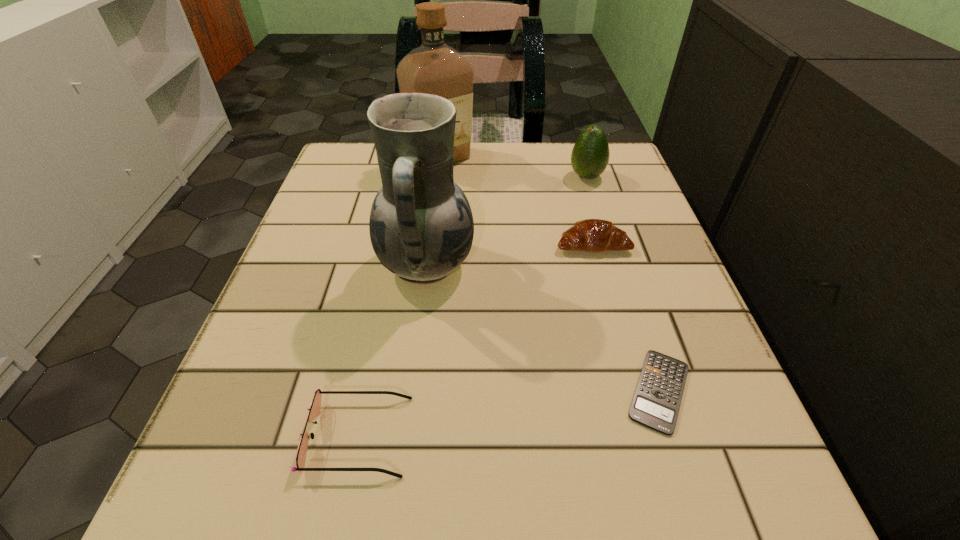
This screenshot has height=540, width=960. In order to click on vacant space situated on the bridge of the fifth tallest object in this screenshot , I will do `click(707, 436)`.

Find the location of a particular element. free point located 0.280m on the left of the calculator is located at coordinates (418, 391).

At what (x,y) coordinates should I click in order to perform the action: click on liquor present at the far edge. Please return your answer as a coordinate pair (x, y). Looking at the image, I should click on (435, 68).

Locate an element on the screen. The width and height of the screenshot is (960, 540). avocado located at the far edge is located at coordinates (590, 155).

Image resolution: width=960 pixels, height=540 pixels. I want to click on object that is at the near edge, so click(x=314, y=409).

Find the location of `object located in the left edge section of the desktop`. object located in the left edge section of the desktop is located at coordinates (314, 409).

This screenshot has height=540, width=960. What are the coordinates of `avocado that is at the right edge` in the screenshot? It's located at (590, 155).

At what (x,y) coordinates should I click in order to perform the action: click on crescent roll that is at the right edge. Please return your answer as a coordinate pair (x, y). The height and width of the screenshot is (540, 960). Looking at the image, I should click on (595, 235).

The image size is (960, 540). I want to click on calculator present at the right edge, so click(x=656, y=402).

You are a GUI agent. You are given a task and a screenshot of the screen. Output one action in this format:
    pyautogui.click(x=<x>, y=<y>)
    Task: Click on the object at the near left corner
    This screenshot has width=960, height=540.
    Given the screenshot: What is the action you would take?
    pyautogui.click(x=314, y=409)